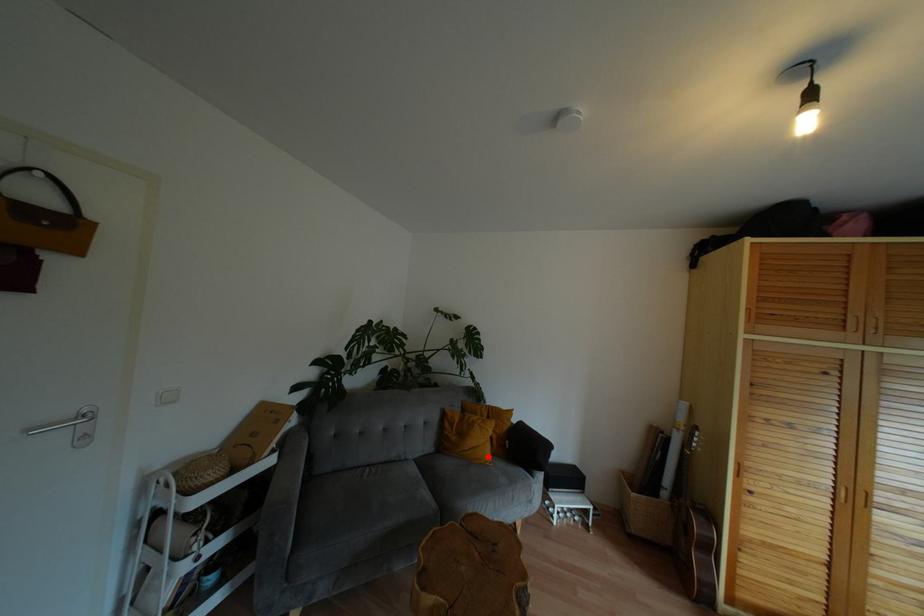
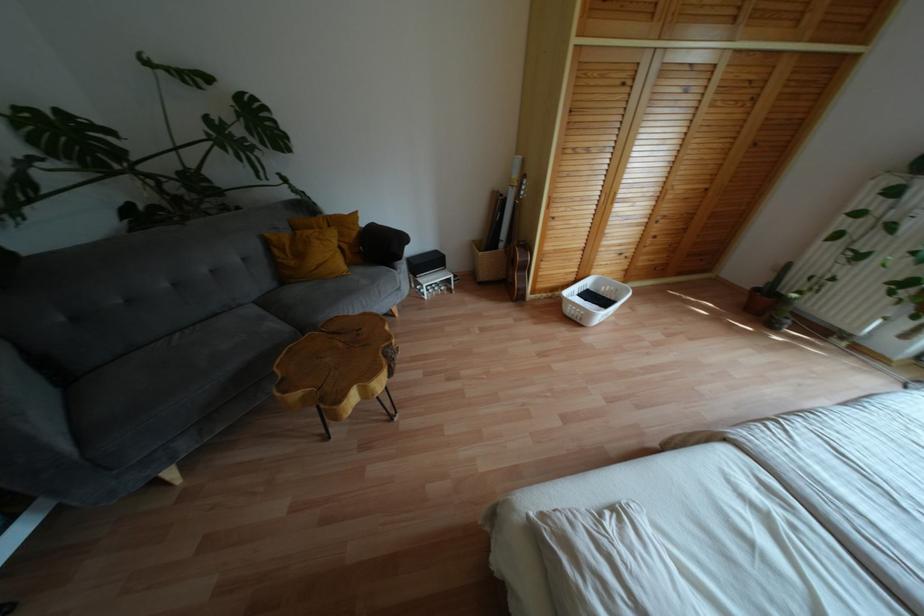
Where in the second image is the point corresponding to the highlighted location from the first image?

(343, 267)